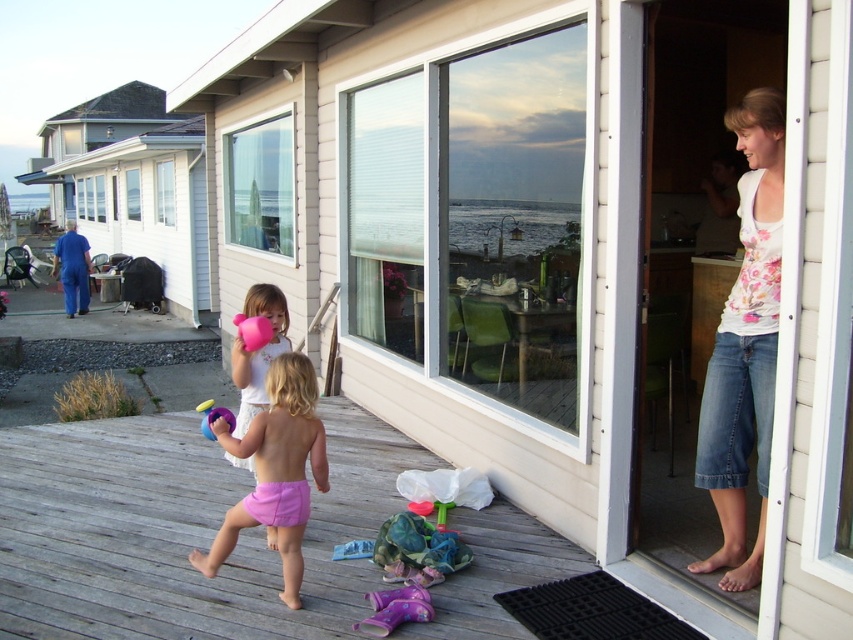
You are a parent trying to choose between the pink fabric balloon at center and the rubber pink ball at center for your child to play with. Which one is smaller in size?

The pink fabric balloon at center is smaller in width than the rubber pink ball at center.

You are a delivery person holding a large package that is 3 feet wide. You need to walk from the pink matte watering can at center to the white matte screen door at upper right. Is there enough space for you to carry the package through the path between them?

The distance between the white matte screen door at upper right and the pink matte watering can at center is 7.04 feet. Since the package is 3 feet wide, there is sufficient space for you to carry it through the path between them as the distance is greater than the package width.